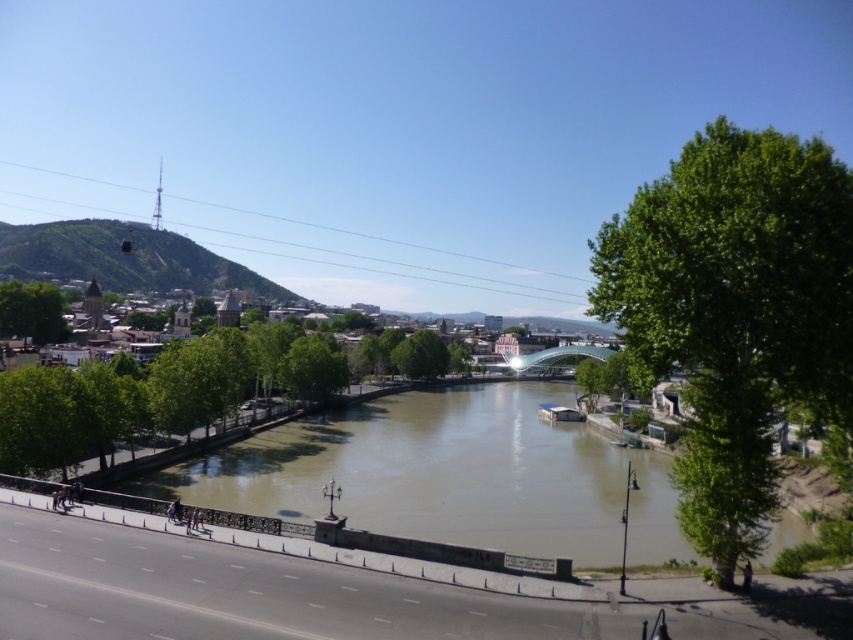
Can you confirm if brown murky water at center is thinner than green leafy tree at center?

In fact, brown murky water at center might be wider than green leafy tree at center.

Between brown murky water at center and green leafy tree at center, which one is positioned higher?

Positioned higher is green leafy tree at center.

Describe the element at coordinates (448, 474) in the screenshot. Image resolution: width=853 pixels, height=640 pixels. I see `brown murky water at center` at that location.

Locate an element on the screen. Image resolution: width=853 pixels, height=640 pixels. brown murky water at center is located at coordinates (448, 474).

Is point (53, 304) positioned after point (549, 349)?

No, (53, 304) is closer to viewer.

You are a GUI agent. You are given a task and a screenshot of the screen. Output one action in this format:
    pyautogui.click(x=<x>, y=<y>)
    Task: Click on the green leafy tree at left
    The image size is (853, 640).
    Given the screenshot: What is the action you would take?
    pyautogui.click(x=32, y=310)

Does green leafy tree at center have a greater width compared to transparent glass bridge at center?

In fact, green leafy tree at center might be narrower than transparent glass bridge at center.

In order to click on green leafy tree at center in this screenshot , I will do `click(421, 355)`.